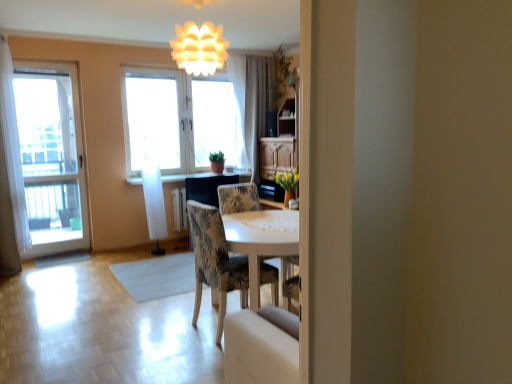
Question: Is white matte light fixture at upper center situated inside transparent glass door at left, which is the second window from back to front, or outside?

Choices:
 (A) outside
 (B) inside

Answer: (A)

Question: Is point (202, 71) closer or farther from the camera than point (50, 249)?

Choices:
 (A) farther
 (B) closer

Answer: (B)

Question: Estimate the real-world distances between objects in this image. Which object is farther from the white sheer curtain at upper center, which is counted as the second curtain, starting from the front?

Choices:
 (A) white sheer curtain at left, placed as the second curtain when sorted from right to left
 (B) transparent glass door at left, which ranks as the 2th window in right-to-left order
 (C) translucent fabric window at center, the second window positioned from the front
 (D) white matte light fixture at upper center
 (E) patterned fabric chair at center

Answer: (A)

Question: Which of these objects is positioned closest to the white sheer curtain at left, placed as the 2th curtain when sorted from back to front?

Choices:
 (A) patterned fabric chair at center
 (B) white matte light fixture at upper center
 (C) translucent fabric window at center, acting as the 1th window starting from the back
 (D) white sheer curtain at upper center, positioned as the first curtain in right-to-left order
 (E) matte black counter top at center

Answer: (C)